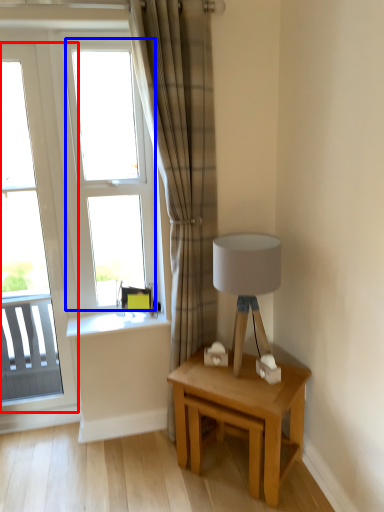
Question: Which point is further to the camera, window (highlighted by a red box) or window (highlighted by a blue box)?

Choices:
 (A) window
 (B) window

Answer: (B)